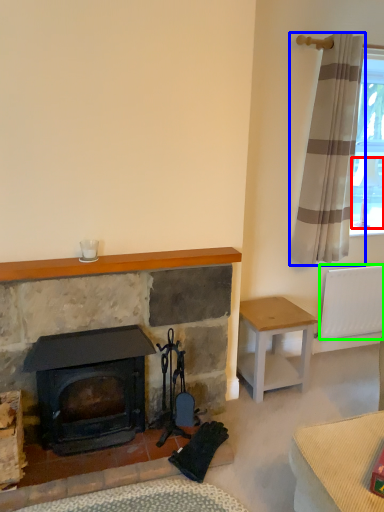
Question: Which is nearer to the lamp (highlighted by a red box)? curtain (highlighted by a blue box) or radiator (highlighted by a green box).

Choices:
 (A) curtain
 (B) radiator

Answer: (A)